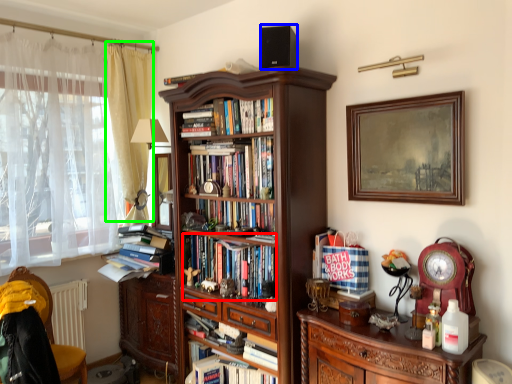
Question: Based on their relative distances, which object is farther from book (highlighted by a red box)? Choose from speaker (highlighted by a blue box) and curtain (highlighted by a green box).

Choices:
 (A) speaker
 (B) curtain

Answer: (A)